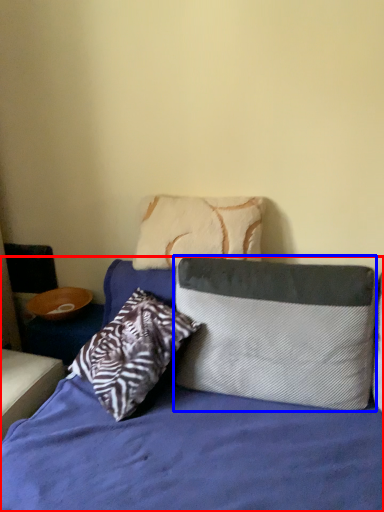
Question: Which object appears farthest to the camera in this image, bed (highlighted by a red box) or pillow (highlighted by a blue box)?

Choices:
 (A) bed
 (B) pillow

Answer: (B)